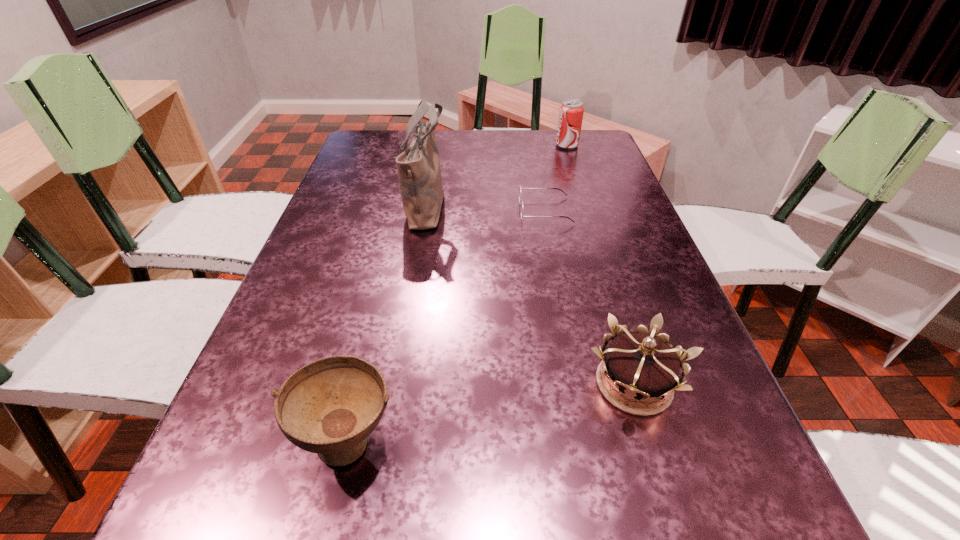
The height and width of the screenshot is (540, 960). Identify the location of free point between the spectacles and the shoulder bag. (486, 208).

I want to click on object identified as the third closest to the shortest object, so click(x=642, y=365).

Locate which object ranks fourth in proximity to the crown. Please provide its 2D coordinates. Your answer should be formatted as a tuple, i.e. [(x, y)], where the tuple contains the x and y coordinates of a point satisfying the conditions above.

[(571, 112)]

What are the coordinates of `free space that satisfies the following two spatial constraints: 1. on the back side of the farthest object; 2. on the left side of the soup bowl` in the screenshot? It's located at (418, 145).

Locate an element on the screen. free region that satisfies the following two spatial constraints: 1. on the front-facing side of the crown; 2. on the right side of the shortest object is located at coordinates (579, 383).

Locate an element on the screen. The image size is (960, 540). free spot that satisfies the following two spatial constraints: 1. on the front-facing side of the spectacles; 2. on the left side of the crown is located at coordinates (579, 383).